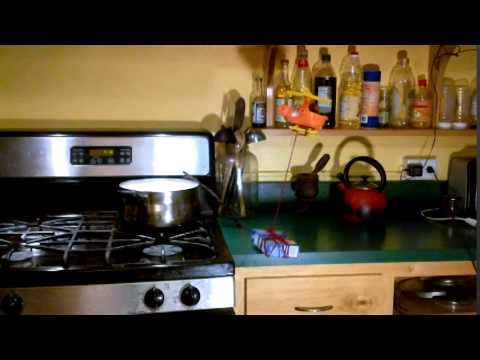
You are a GUI agent. You are given a task and a screenshot of the screen. Output one action in this format:
    pyautogui.click(x=<x>, y=<y>)
    Task: Click on the kettle
    This screenshot has width=480, height=360.
    Given the screenshot: What is the action you would take?
    pyautogui.click(x=367, y=198)